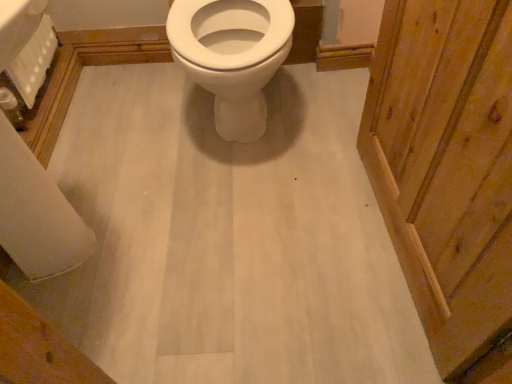
Question: Would you say white matte toilet paper at lower left, the second toilet paper viewed from the left, is outside white textured toilet paper at upper left, the 1th toilet paper positioned from the left?

Choices:
 (A) yes
 (B) no

Answer: (A)

Question: Is white matte toilet paper at lower left, which is counted as the 1th toilet paper, starting from the right, positioned with its back to white textured toilet paper at upper left, which appears as the 2th toilet paper when viewed from the right?

Choices:
 (A) no
 (B) yes

Answer: (A)

Question: Does white matte toilet paper at lower left, which is counted as the 1th toilet paper, starting from the right, have a smaller size compared to white textured toilet paper at upper left, the 1th toilet paper positioned from the left?

Choices:
 (A) yes
 (B) no

Answer: (A)

Question: Is white matte toilet paper at lower left, which is counted as the 1th toilet paper, starting from the right, surrounding white textured toilet paper at upper left, the 1th toilet paper positioned from the left?

Choices:
 (A) yes
 (B) no

Answer: (B)

Question: Does white matte toilet paper at lower left, the second toilet paper viewed from the left, come behind white textured toilet paper at upper left, the 1th toilet paper positioned from the left?

Choices:
 (A) no
 (B) yes

Answer: (A)

Question: Does point (257, 1) appear closer or farther from the camera than point (31, 157)?

Choices:
 (A) closer
 (B) farther

Answer: (B)

Question: From the image's perspective, is white glossy toilet at center located above or below white matte toilet paper at lower left, which is counted as the 1th toilet paper, starting from the right?

Choices:
 (A) below
 (B) above

Answer: (B)

Question: Is white glossy toilet at center taller or shorter than white matte toilet paper at lower left, the second toilet paper viewed from the left?

Choices:
 (A) tall
 (B) short

Answer: (A)

Question: From a real-world perspective, relative to white matte toilet paper at lower left, the second toilet paper viewed from the left, is white glossy toilet at center vertically above or below?

Choices:
 (A) below
 (B) above

Answer: (B)

Question: Do you think white matte toilet paper at lower left, the second toilet paper viewed from the left, is within white glossy toilet at center, or outside of it?

Choices:
 (A) outside
 (B) inside

Answer: (A)

Question: Based on their sizes in the image, would you say white matte toilet paper at lower left, which is counted as the 1th toilet paper, starting from the right, is bigger or smaller than white glossy toilet at center?

Choices:
 (A) big
 (B) small

Answer: (B)

Question: From the image's perspective, is white matte toilet paper at lower left, which is counted as the 1th toilet paper, starting from the right, above or below white glossy toilet at center?

Choices:
 (A) above
 (B) below

Answer: (B)

Question: Considering their positions, is white matte toilet paper at lower left, which is counted as the 1th toilet paper, starting from the right, located in front of or behind white glossy toilet at center?

Choices:
 (A) behind
 (B) front

Answer: (A)

Question: Relative to white matte toilet paper at lower left, which is counted as the 1th toilet paper, starting from the right, is white textured toilet paper at upper left, the 1th toilet paper positioned from the left, in front or behind?

Choices:
 (A) front
 (B) behind

Answer: (B)

Question: Is white textured toilet paper at upper left, which appears as the 2th toilet paper when viewed from the right, inside or outside of white matte toilet paper at lower left, the second toilet paper viewed from the left?

Choices:
 (A) inside
 (B) outside

Answer: (B)